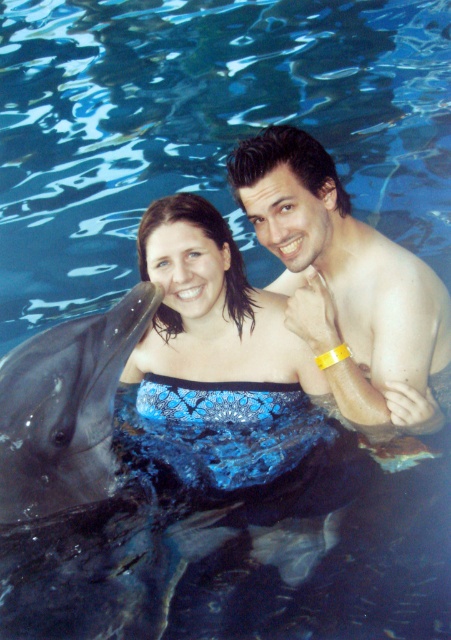
Is smooth skin man at upper right wider than gray smooth dolphin at left?

Yes.

This screenshot has width=451, height=640. I want to click on smooth skin man at upper right, so click(x=345, y=282).

Locate an element on the screen. smooth skin man at upper right is located at coordinates (345, 282).